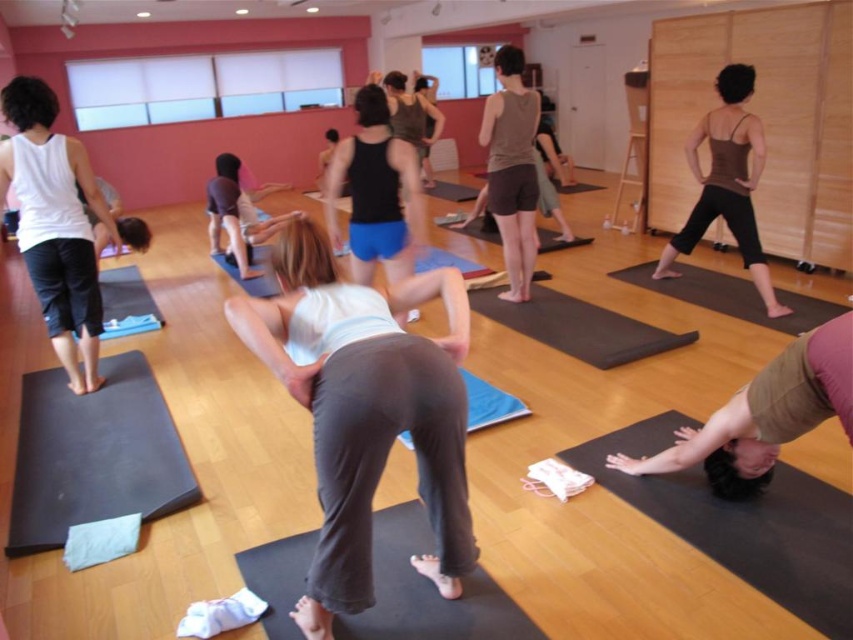
Which is in front, point (762, 252) or point (119, 314)?

Point (762, 252)

Which is more to the right, matte brown tank top at center or blue rubber yoga mat at lower left?

matte brown tank top at center

Who is more forward, (718, 106) or (103, 321)?

Point (103, 321) is more forward.

Image resolution: width=853 pixels, height=640 pixels. What are the coordinates of `matte brown tank top at center` in the screenshot? It's located at (727, 180).

Who is higher up, black rubber yoga mat at lower left or black rubber mat at center?

Positioned higher is black rubber mat at center.

Who is more distant from viewer, (44,449) or (546,300)?

The point (546,300) is behind.

Image resolution: width=853 pixels, height=640 pixels. I want to click on black rubber yoga mat at lower left, so click(x=94, y=454).

Between black rubber yoga mat at center and black matte tank top at center, which one has less height?

Standing shorter between the two is black rubber yoga mat at center.

Does point (401, 620) come behind point (369, 193)?

No, (401, 620) is closer to viewer.

The width and height of the screenshot is (853, 640). I want to click on black rubber yoga mat at center, so click(427, 593).